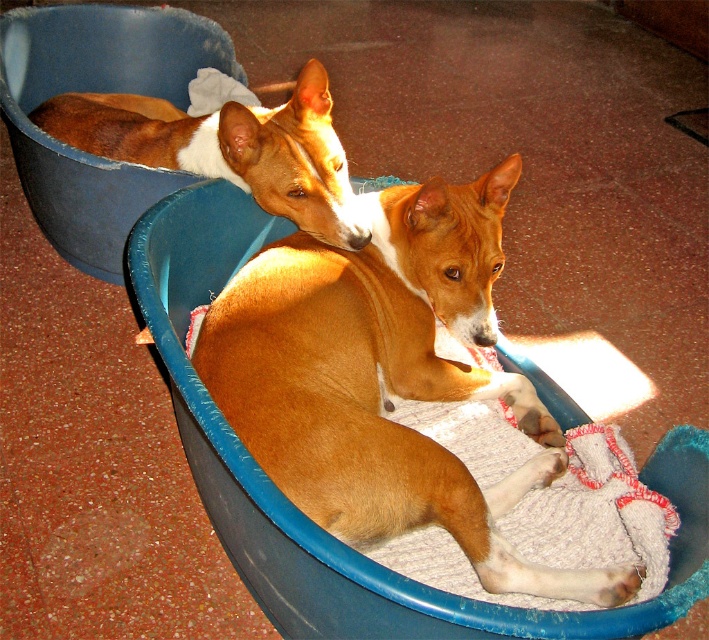
Is brown furry dog at center shorter than brown smooth dog at upper left?

In fact, brown furry dog at center may be taller than brown smooth dog at upper left.

From the picture: Is brown furry dog at center positioned behind brown smooth dog at upper left?

No, it is not.

Is point (301, 355) farther from camera compared to point (250, 145)?

No, it is in front of (250, 145).

At what (x,y) coordinates should I click in order to perform the action: click on brown furry dog at center. Please return your answer as a coordinate pair (x, y). The image size is (709, 640). Looking at the image, I should click on (386, 380).